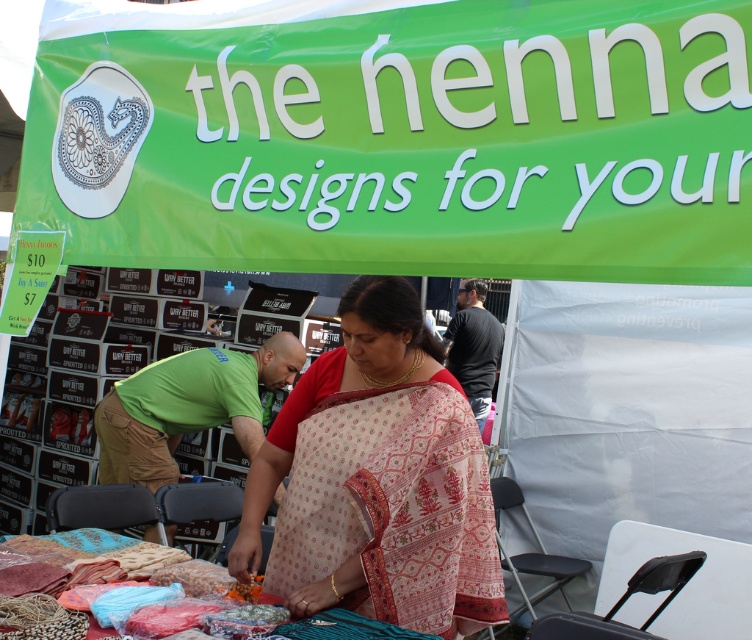
You are a customer at the market and want to buy both items priced at 10 and 7 dollars. However, you notice that the patterned silk saree at center and the textured fabric at center are very close to each other. Can you estimate if there is enough space between them to comfortably pick up both items without touching them?

The distance between the patterned silk saree at center and the textured fabric at center is 15.71 inches, which is more than enough space to comfortably pick up both items without touching them.

Based on the photo, you are a customer at the market and want to buy a henna design product. The vendor is standing at the point marked by the coordinates point (378, 480). Where should you go to find the vendor selling the henna design products?

The vendor selling the henna design products is located at the point marked by the coordinates point (378, 480), which corresponds to the patterned silk saree at center. Therefore, you should go to the patterned silk saree at center to find the vendor.

You are a customer at the market and want to know which item is wider between the patterned silk saree at center and the textured fabric at center. Which one is wider?

The textured fabric at center is wider than the patterned silk saree at center.